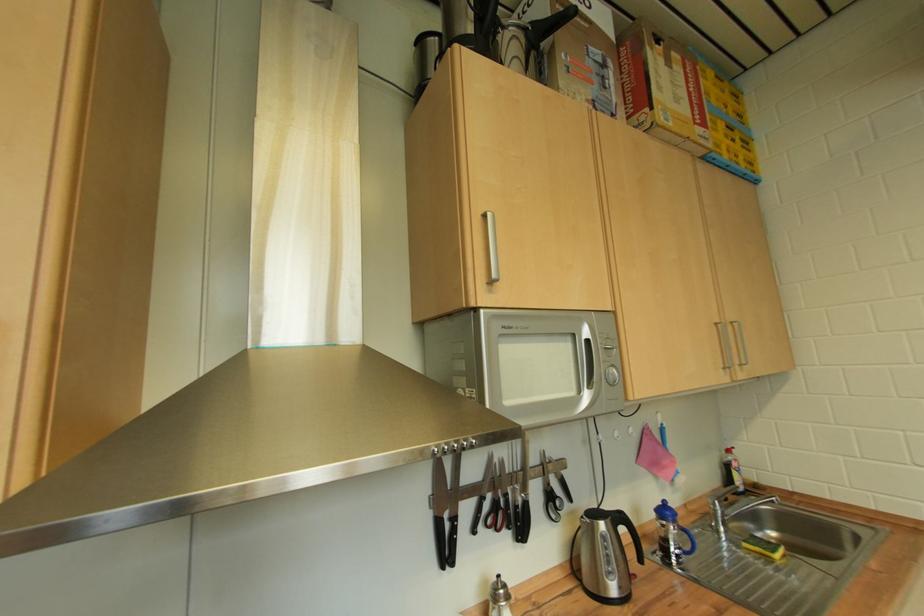
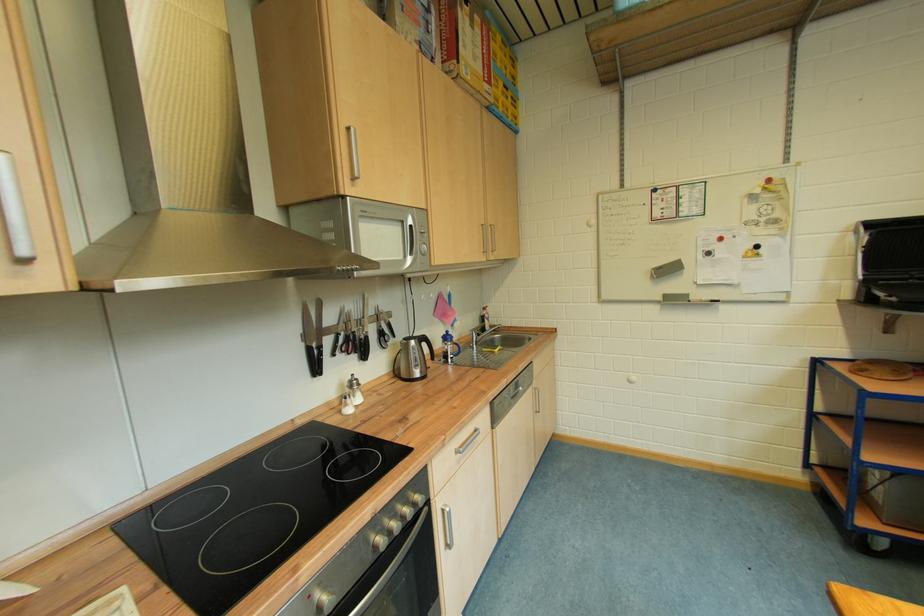
Find the pixel in the second image that matches pixel 723 326 in the first image.

(490, 228)